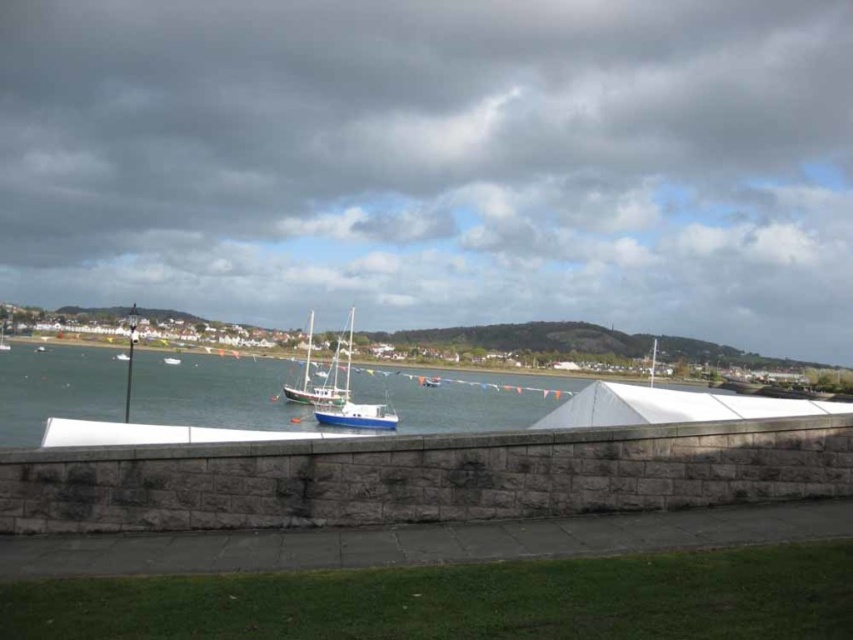
Question: Can you confirm if wooden sailboat at center is wider than blue polished wood sailboat at center?

Choices:
 (A) yes
 (B) no

Answer: (A)

Question: Is wooden sailboat at center above blue polished wood sailboat at center?

Choices:
 (A) yes
 (B) no

Answer: (A)

Question: Which object appears closest to the camera in this image?

Choices:
 (A) wooden sailboat at center
 (B) blue polished wood sailboat at center

Answer: (B)

Question: Which point is farther from the camera taking this photo?

Choices:
 (A) (357, 403)
 (B) (349, 332)

Answer: (A)

Question: Which of the following is the farthest from the observer?

Choices:
 (A) wooden sailboat at center
 (B) blue polished wood sailboat at center

Answer: (A)

Question: From the image, what is the correct spatial relationship of wooden sailboat at center in relation to blue polished wood sailboat at center?

Choices:
 (A) below
 (B) above

Answer: (B)